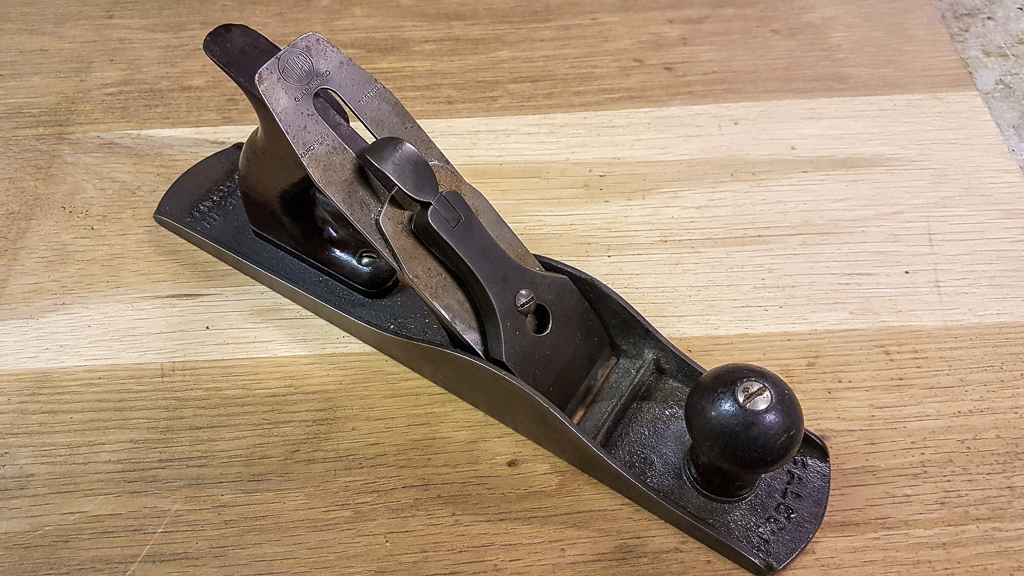
This screenshot has width=1024, height=576. Find the location of `light wood grain`. light wood grain is located at coordinates (869, 140), (238, 132), (195, 310), (358, 131).